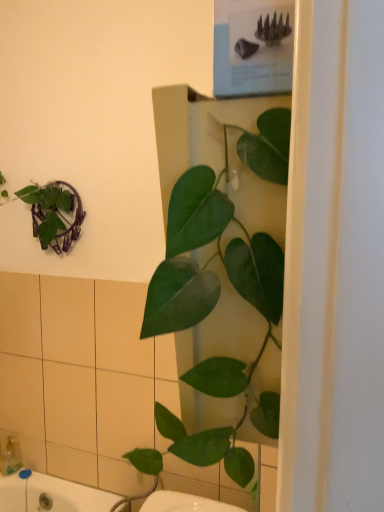
Question: Can you confirm if translucent plastic soap dispenser at lower left is positioned to the right of green glossy leafy plant at center?

Choices:
 (A) no
 (B) yes

Answer: (A)

Question: Can you confirm if translucent plastic soap dispenser at lower left is wider than green glossy leafy plant at center?

Choices:
 (A) no
 (B) yes

Answer: (B)

Question: Does translucent plastic soap dispenser at lower left contain green glossy leafy plant at center?

Choices:
 (A) no
 (B) yes

Answer: (A)

Question: Considering the relative positions of translucent plastic soap dispenser at lower left and green glossy leafy plant at center in the image provided, is translucent plastic soap dispenser at lower left behind green glossy leafy plant at center?

Choices:
 (A) no
 (B) yes

Answer: (B)

Question: Can you confirm if translucent plastic soap dispenser at lower left is smaller than green glossy leafy plant at center?

Choices:
 (A) no
 (B) yes

Answer: (B)

Question: From a real-world perspective, is translucent plastic soap dispenser at lower left located higher than green glossy leafy plant at center?

Choices:
 (A) no
 (B) yes

Answer: (A)

Question: Is green glossy leafy plant at center not close to translucent plastic soap dispenser at lower left?

Choices:
 (A) yes
 (B) no

Answer: (A)

Question: Can you confirm if green glossy leafy plant at center is positioned to the right of translucent plastic soap dispenser at lower left?

Choices:
 (A) no
 (B) yes

Answer: (B)

Question: Can you confirm if green glossy leafy plant at center is wider than translucent plastic soap dispenser at lower left?

Choices:
 (A) yes
 (B) no

Answer: (B)

Question: Is translucent plastic soap dispenser at lower left inside green glossy leafy plant at center?

Choices:
 (A) no
 (B) yes

Answer: (A)

Question: Is translucent plastic soap dispenser at lower left at the back of green glossy leafy plant at center?

Choices:
 (A) no
 (B) yes

Answer: (A)

Question: From a real-world perspective, is green glossy leafy plant at center under translucent plastic soap dispenser at lower left?

Choices:
 (A) no
 (B) yes

Answer: (A)

Question: From a real-world perspective, relative to green glossy leafy plant at center, is translucent plastic soap dispenser at lower left vertically above or below?

Choices:
 (A) above
 (B) below

Answer: (B)